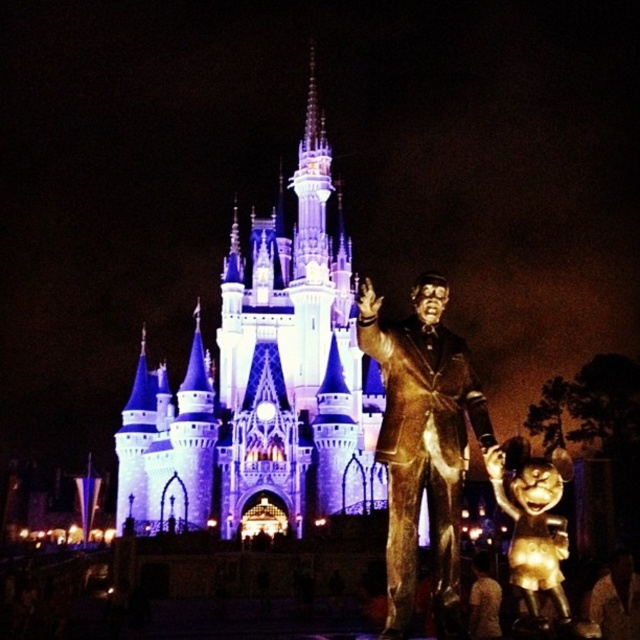
Question: Which of the following is the closest to the observer?

Choices:
 (A) (518, 461)
 (B) (413, 353)
 (C) (300, 253)

Answer: (B)

Question: Is bronze statue at center wider than gold metallic minnie mouse at lower right?

Choices:
 (A) yes
 (B) no

Answer: (B)

Question: Which of the following is the closest to the observer?

Choices:
 (A) bronze statue at center
 (B) gold metallic minnie mouse at lower right

Answer: (B)

Question: Can you confirm if illuminated stone castle at center is positioned to the left of gold metallic minnie mouse at lower right?

Choices:
 (A) yes
 (B) no

Answer: (A)

Question: Which object is farther from the camera taking this photo?

Choices:
 (A) bronze statue at center
 (B) illuminated stone castle at center

Answer: (A)

Question: Does illuminated stone castle at center have a smaller size compared to gold metallic minnie mouse at lower right?

Choices:
 (A) yes
 (B) no

Answer: (B)